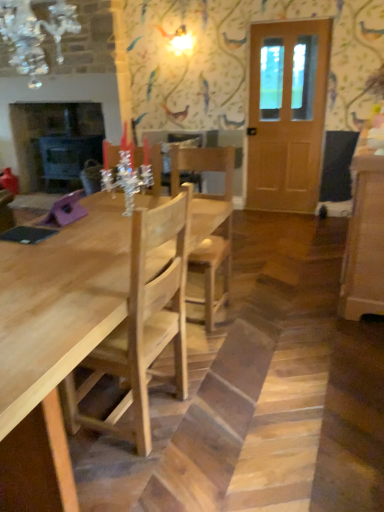
Where is `wooden door at right`? wooden door at right is located at coordinates (287, 114).

Image resolution: width=384 pixels, height=512 pixels. What are the coordinates of `light wood table at center` in the screenshot? It's located at (54, 344).

What do you see at coordinates (34, 35) in the screenshot? This screenshot has width=384, height=512. I see `crystal glass chandelier at upper left` at bounding box center [34, 35].

The image size is (384, 512). Find the location of `matte black fireplace at left`. matte black fireplace at left is located at coordinates (56, 142).

You are a GUI agent. You are given a task and a screenshot of the screen. Output one action in this format:
    pyautogui.click(x=<x>, y=<y>)
    Task: Click on the wooden door at right
    
    Given the screenshot: What is the action you would take?
    pyautogui.click(x=287, y=114)

Would you say light wood table at center is a long distance from natural wood chair at center?

Actually, light wood table at center and natural wood chair at center are a little close together.

Which object is closer to the camera, light wood table at center or natural wood chair at center?

light wood table at center.

Between light wood table at center and natural wood chair at center, which one has less height?

light wood table at center is shorter.

Is light wood table at center to the left or to the right of natural wood chair at center in the image?

In the image, light wood table at center appears on the left side of natural wood chair at center.

Which object is positioned more to the right, light wood table at center or wooden door at right?

From the viewer's perspective, wooden door at right appears more on the right side.

From the image's perspective, is light wood table at center above or below wooden door at right?

light wood table at center is below wooden door at right.

Can you confirm if light wood table at center is shorter than wooden door at right?

Correct, light wood table at center is not as tall as wooden door at right.

Is matte black fireplace at left facing towards wooden door at right?

No, matte black fireplace at left is not turned towards wooden door at right.

Which of these two, matte black fireplace at left or wooden door at right, is smaller?

With smaller size is wooden door at right.

Which is in front, point (43, 157) or point (309, 192)?

Point (309, 192)

Is natural wood chair at center bigger than matte black fireplace at left?

No.

From a real-world perspective, is natural wood chair at center on matte black fireplace at left?

No, from a real-world perspective, natural wood chair at center is not on top of matte black fireplace at left.

Is there a large distance between natural wood chair at center and matte black fireplace at left?

natural wood chair at center is far away from matte black fireplace at left.

Is matte black fireplace at left at the back of natural wood chair at center?

No, matte black fireplace at left is not at the back of natural wood chair at center.

Is crystal glass chandelier at upper left next to light wood table at center and touching it?

No, crystal glass chandelier at upper left is not with light wood table at center.

Is crystal glass chandelier at upper left oriented away from light wood table at center?

crystal glass chandelier at upper left does not have its back to light wood table at center.

Which is in front, point (61, 61) or point (127, 256)?

The point (127, 256) is in front.

Between crystal glass chandelier at upper left and light wood table at center, which one has larger size?

With larger size is light wood table at center.

Is the surface of light wood table at center in direct contact with matte black fireplace at left?

No, light wood table at center is not touching matte black fireplace at left.

In the scene shown: Can you confirm if light wood table at center is positioned to the right of matte black fireplace at left?

Indeed, light wood table at center is positioned on the right side of matte black fireplace at left.

From the image's perspective, which is above, light wood table at center or matte black fireplace at left?

matte black fireplace at left.

Looking at this image, could you tell me if light wood table at center is facing matte black fireplace at left?

No, light wood table at center does not turn towards matte black fireplace at left.

Is wooden door at right a part of light brown wood cabinet at right?

Actually, wooden door at right is outside light brown wood cabinet at right.

Does light brown wood cabinet at right lie behind wooden door at right?

No, light brown wood cabinet at right is closer to the camera.

Which of these two, light brown wood cabinet at right or wooden door at right, stands shorter?

light brown wood cabinet at right is shorter.

Where is `chair behind the light wood table at center`? This screenshot has width=384, height=512. chair behind the light wood table at center is located at coordinates (208, 221).

You are a GUI agent. You are given a task and a screenshot of the screen. Output one action in this format:
    pyautogui.click(x=<x>, y=<y>)
    Task: Click on the kitchen & dining room table that appears on the left of wooden door at right
    This screenshot has width=384, height=512.
    Given the screenshot: What is the action you would take?
    pyautogui.click(x=54, y=344)

From the picture: Estimate the real-world distances between objects in this image. Which object is closer to natural wood chair at center, light wood table at center or crystal glass chandelier at upper left?

Among the two, light wood table at center is located nearer to natural wood chair at center.

Considering their positions, is light wood table at center positioned closer to crystal glass chandelier at upper left than natural wood chair at center?

The object closer to crystal glass chandelier at upper left is natural wood chair at center.

Which object lies nearer to the anchor point crystal glass chandelier at upper left, wooden door at right or natural wood chair at center?

natural wood chair at center lies closer to crystal glass chandelier at upper left than the other object.

Which object lies further to the anchor point natural wood chair at center, light wood table at center or light brown wood cabinet at right?

The object further to natural wood chair at center is light brown wood cabinet at right.

Consider the image. From the image, which object appears to be farther from crystal glass chandelier at upper left, matte black fireplace at left or light wood table at center?

Among the two, light wood table at center is located further to crystal glass chandelier at upper left.

Based on their spatial positions, is light wood table at center or natural wood chair at center further from matte black fireplace at left?

Based on the image, light wood table at center appears to be further to matte black fireplace at left.

Estimate the real-world distances between objects in this image. Which object is further from light brown wood cabinet at right, crystal glass chandelier at upper left or matte black fireplace at left?

matte black fireplace at left is positioned further to the anchor light brown wood cabinet at right.

Based on their spatial positions, is matte black fireplace at left or natural wood chair at center further from crystal glass chandelier at upper left?

Based on the image, natural wood chair at center appears to be further to crystal glass chandelier at upper left.

Where is `kitchen & dining room table positioned between crystal glass chandelier at upper left and wooden door at right from near to far`? kitchen & dining room table positioned between crystal glass chandelier at upper left and wooden door at right from near to far is located at coordinates (54, 344).

Find the location of a particular element. Image resolution: width=384 pixels, height=512 pixels. door located between light wood table at center and matte black fireplace at left in the depth direction is located at coordinates (287, 114).

This screenshot has width=384, height=512. I want to click on kitchen & dining room table between crystal glass chandelier at upper left and matte black fireplace at left from front to back, so click(x=54, y=344).

Locate an element on the screen. cabinetry between crystal glass chandelier at upper left and wooden door at right from front to back is located at coordinates (364, 237).